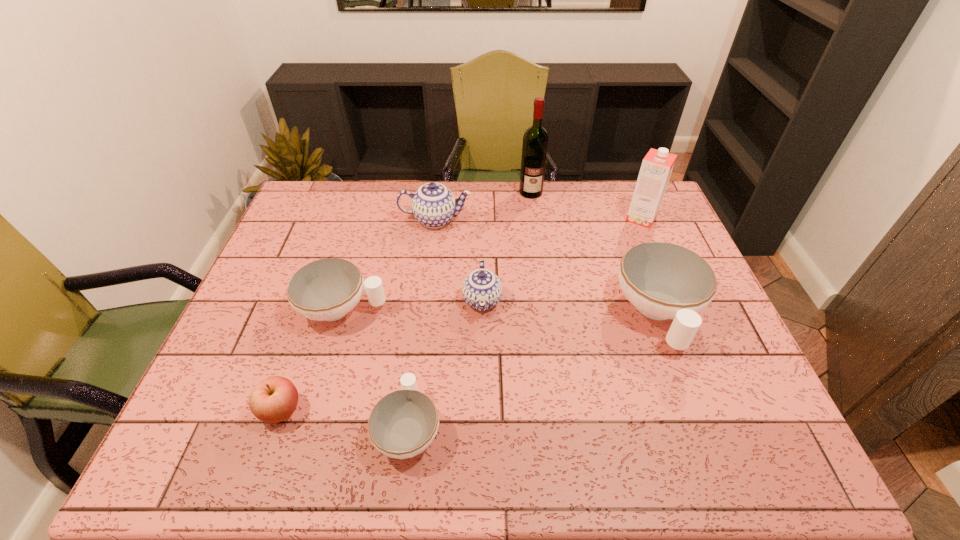
What are the coordinates of `empty space that is in between the second smallest white chinaware and the red apple` in the screenshot? It's located at (312, 359).

Image resolution: width=960 pixels, height=540 pixels. I want to click on empty location between the bigger blue chinaware and the alcohol, so click(483, 206).

You are a GUI agent. You are given a task and a screenshot of the screen. Output one action in this format:
    pyautogui.click(x=<x>, y=<y>)
    Task: Click on the free space that is in between the rightmost chinaware and the farthest chinaware
    
    Given the screenshot: What is the action you would take?
    pyautogui.click(x=546, y=267)

Where is `free space between the nearest white chinaware and the carton`? The width and height of the screenshot is (960, 540). free space between the nearest white chinaware and the carton is located at coordinates (525, 323).

Locate an element on the screen. empty location between the nearer blue chinaware and the alcohol is located at coordinates (507, 246).

Where is `free space between the sixth object from left to right and the second biggest white chinaware`? free space between the sixth object from left to right and the second biggest white chinaware is located at coordinates (437, 251).

Find the location of a particular element. free point between the biggest white chinaware and the nearer blue chinaware is located at coordinates (570, 307).

I want to click on free spot between the shortest object and the biggest white chinaware, so click(533, 371).

Locate which object ranks fourth in proximity to the second biggest white chinaware. Please provide its 2D coordinates. Your answer should be formatted as a tuple, i.e. [(x, y)], where the tuple contains the x and y coordinates of a point satisfying the conditions above.

[(433, 205)]

Select which object appears as the second closest to the farthest chinaware. Please provide its 2D coordinates. Your answer should be formatted as a tuple, i.e. [(x, y)], where the tuple contains the x and y coordinates of a point satisfying the conditions above.

[(482, 289)]